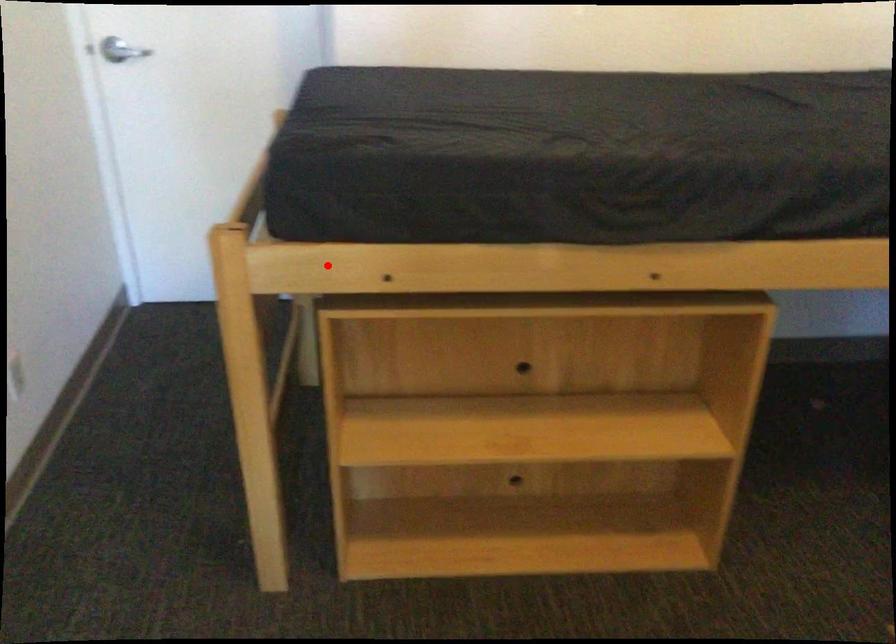
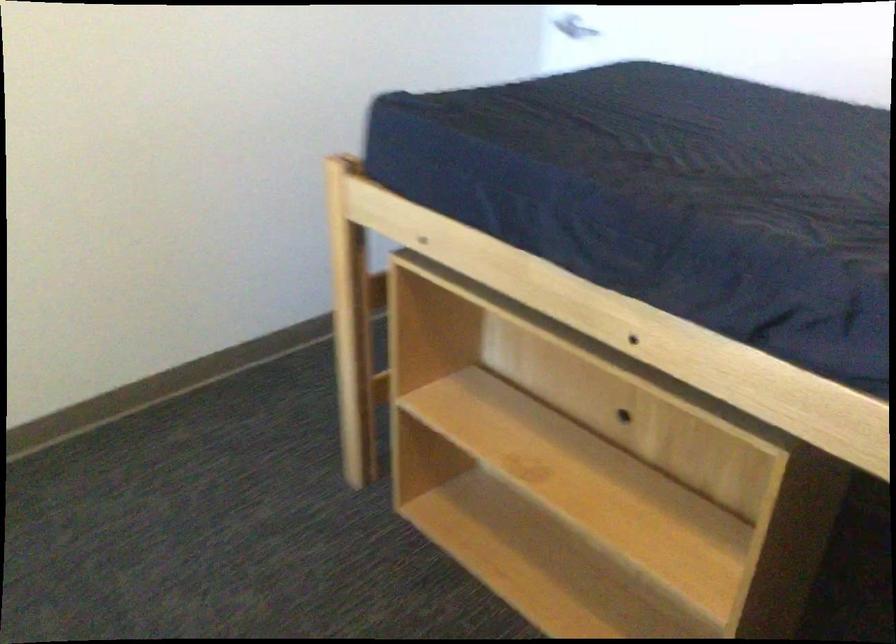
Find the pixel in the second image that matches the highlighted location in the first image.

(392, 214)